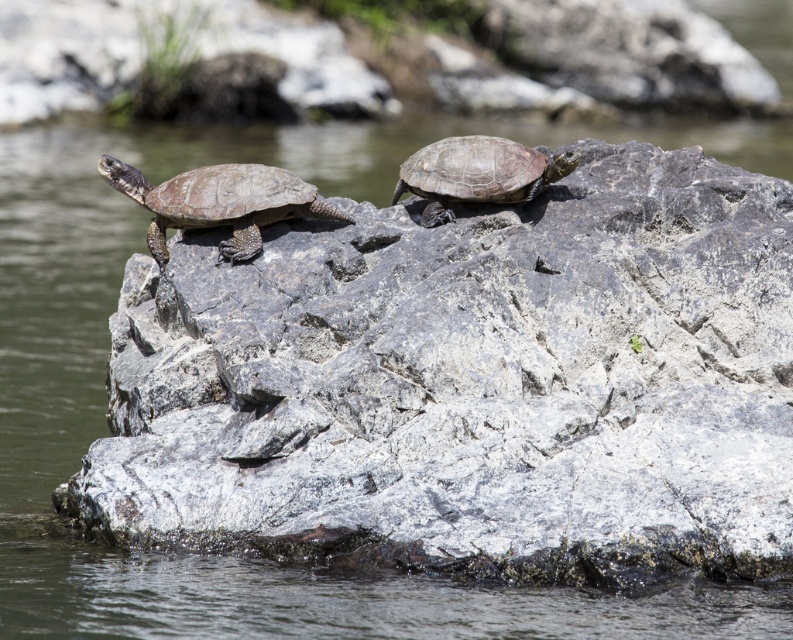
Based on the photo, does matte brown tortoise at left appear on the left side of matte brown tortoise at center?

Indeed, matte brown tortoise at left is positioned on the left side of matte brown tortoise at center.

Does matte brown tortoise at left have a larger size compared to matte brown tortoise at center?

No.

The image size is (793, 640). Describe the element at coordinates (219, 202) in the screenshot. I see `matte brown tortoise at left` at that location.

Identify the location of matte brown tortoise at left. Image resolution: width=793 pixels, height=640 pixels. (219, 202).